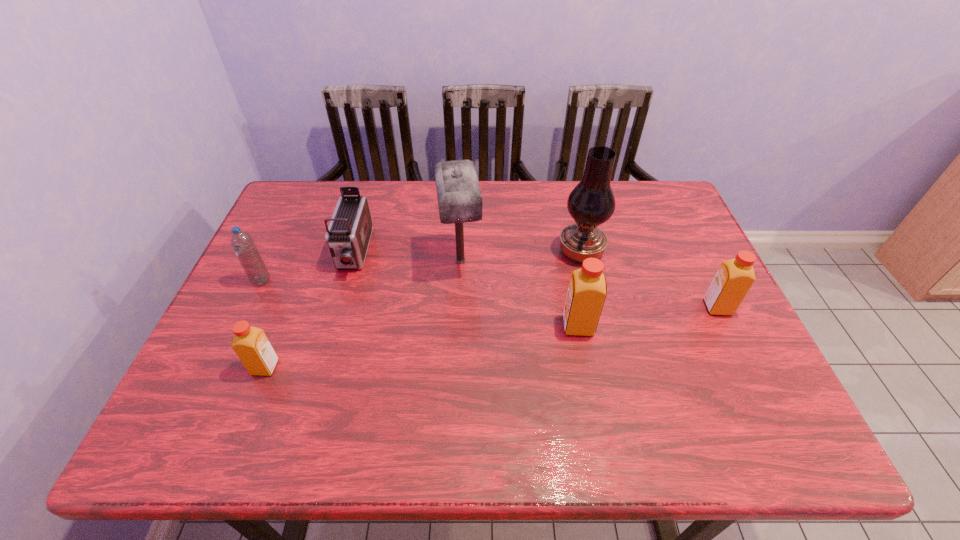
Find the location of `the nearest orange juice`. the nearest orange juice is located at coordinates (251, 345).

Locate an element on the screen. The image size is (960, 540). the shortest orange juice is located at coordinates pyautogui.click(x=251, y=345).

Image resolution: width=960 pixels, height=540 pixels. In order to click on the second orange juice from right to left in this screenshot , I will do `click(587, 290)`.

Where is `the rightmost object`? the rightmost object is located at coordinates (734, 278).

Locate an element on the screen. The width and height of the screenshot is (960, 540). the rightmost orange juice is located at coordinates (734, 278).

Find the location of a particular element. the third object from left to right is located at coordinates (348, 235).

The image size is (960, 540). I want to click on oil lamp, so point(591,203).

This screenshot has height=540, width=960. Identify the location of mallet. (459, 197).

Where is `the leftmost object`? The height and width of the screenshot is (540, 960). the leftmost object is located at coordinates (243, 245).

The height and width of the screenshot is (540, 960). I want to click on vacant region located 0.060m on the front and back of the shortest orange juice, so click(x=227, y=367).